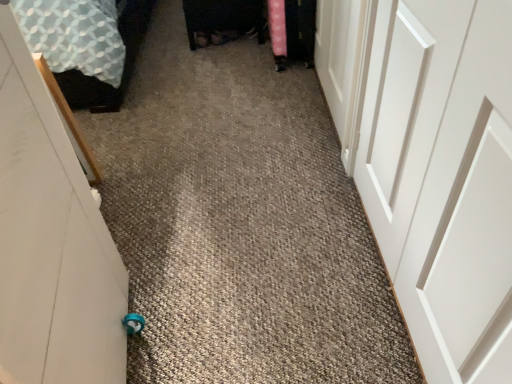
This screenshot has height=384, width=512. I want to click on vacant space that's between white matte door at left, placed as the first door when sorted from left to right, and white smooth door at right, which is counted as the first door, starting from the right, so click(x=274, y=284).